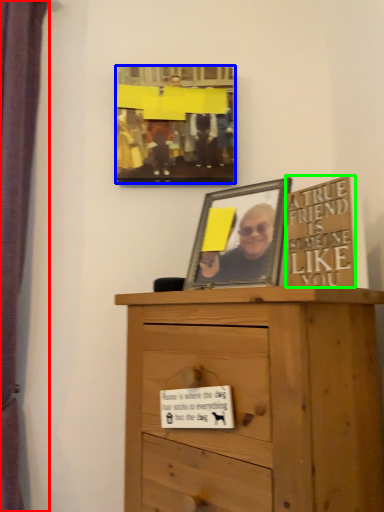
Question: Considering the real-world distances, which object is farthest from curtain (highlighted by a red box)? picture frame (highlighted by a blue box) or writing (highlighted by a green box)?

Choices:
 (A) picture frame
 (B) writing

Answer: (B)